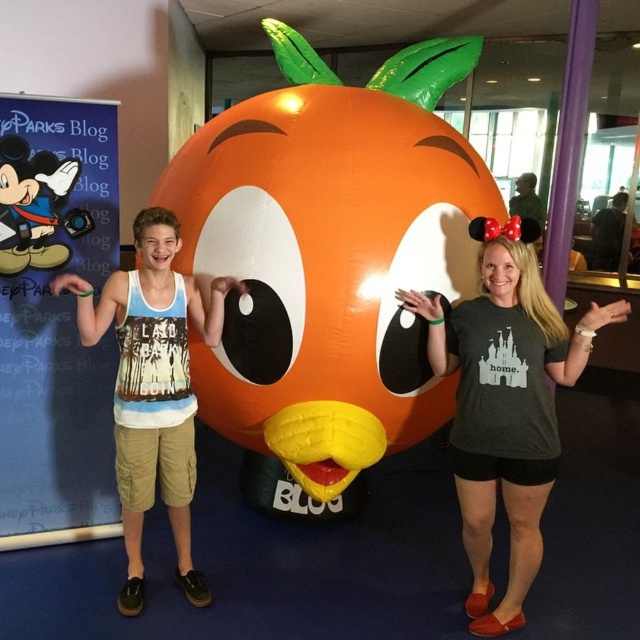
Question: Estimate the real-world distances between objects in this image. Which object is farther from the dark gray t-shirt at center?

Choices:
 (A) white cotton tank top at center
 (B) inflatable orange at center

Answer: (A)

Question: Can you confirm if brushed metal mickey mouse poster at left is bigger than dark gray t-shirt at center?

Choices:
 (A) yes
 (B) no

Answer: (B)

Question: Among these points, which one is farthest from the camera?

Choices:
 (A) (131, 550)
 (B) (525, 301)
 (C) (112, 138)
 (D) (196, 209)

Answer: (C)

Question: Does brushed metal mickey mouse poster at left come behind dark gray t-shirt at center?

Choices:
 (A) yes
 (B) no

Answer: (A)

Question: Can you confirm if dark gray t-shirt at center is positioned above white cotton tank top at center?

Choices:
 (A) no
 (B) yes

Answer: (A)

Question: Considering the real-world distances, which object is closest to the white cotton tank top at center?

Choices:
 (A) brushed metal mickey mouse poster at left
 (B) inflatable orange at center
 (C) dark gray t-shirt at center

Answer: (A)